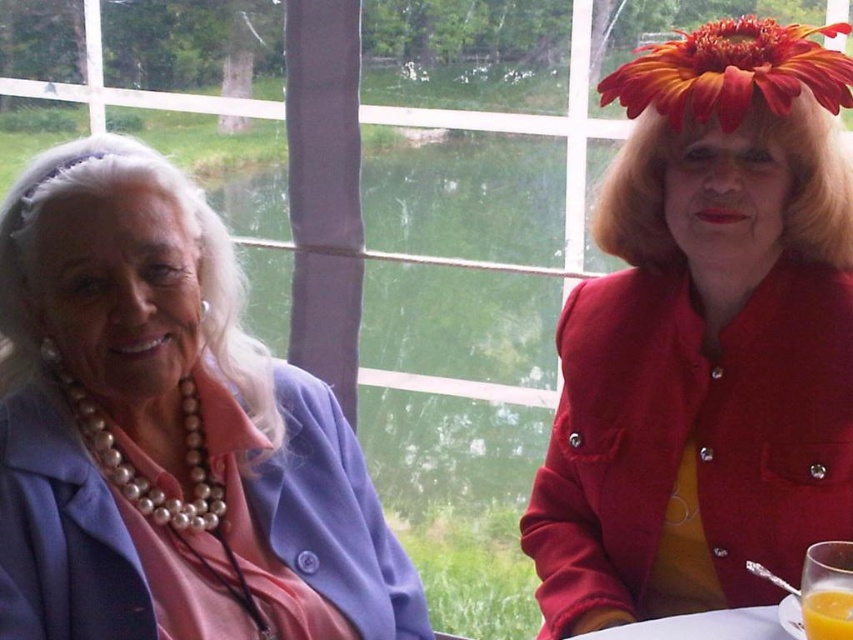
Question: Estimate the real-world distances between objects in this image. Which object is farther from the pearl necklace at left?

Choices:
 (A) translucent glass cup at lower right
 (B) fluffy orange-red flower at upper right

Answer: (A)

Question: Is fluffy orange-red flower at upper right to the left of translucent glass cup at lower right from the viewer's perspective?

Choices:
 (A) yes
 (B) no

Answer: (B)

Question: Is matte red coat at right closer to the viewer compared to fluffy orange-red flower at upper right?

Choices:
 (A) yes
 (B) no

Answer: (B)

Question: Is matte red coat at right smaller than pearl necklace at left?

Choices:
 (A) yes
 (B) no

Answer: (A)

Question: Considering the real-world distances, which object is farthest from the matte red coat at right?

Choices:
 (A) fluffy orange-red flower at upper right
 (B) pearl necklace at left

Answer: (B)

Question: Which point is farther from the camera taking this photo?

Choices:
 (A) (733, 125)
 (B) (840, 435)
 (C) (840, 588)
 (D) (230, 454)

Answer: (D)